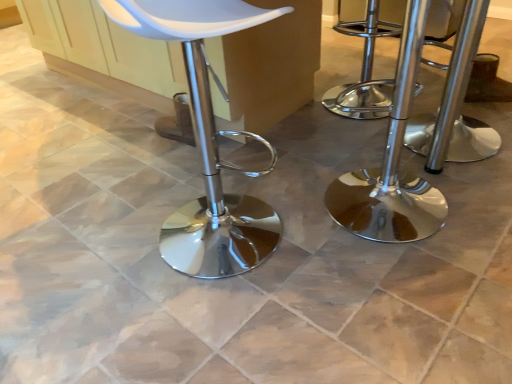
Question: Can you confirm if white matte stool at center is wider than chrome/metallic stool at right, acting as the first stool starting from the left?

Choices:
 (A) no
 (B) yes

Answer: (B)

Question: Does white matte stool at center come behind chrome/metallic stool at right, the second stool positioned from the right?

Choices:
 (A) yes
 (B) no

Answer: (B)

Question: Does white matte stool at center have a smaller size compared to chrome/metallic stool at right, acting as the first stool starting from the left?

Choices:
 (A) no
 (B) yes

Answer: (A)

Question: From the image's perspective, is white matte stool at center located beneath chrome/metallic stool at right, the second stool positioned from the right?

Choices:
 (A) no
 (B) yes

Answer: (B)

Question: Can you confirm if white matte stool at center is positioned to the left of chrome/metallic stool at right, the second stool positioned from the right?

Choices:
 (A) yes
 (B) no

Answer: (A)

Question: Is white matte stool at center aimed at chrome/metallic stool at right, the second stool positioned from the right?

Choices:
 (A) no
 (B) yes

Answer: (B)

Question: From the image's perspective, would you say polished chrome stool at center, which is the 2th stool from left to right, is positioned over chrome/metallic stool at right, the second stool positioned from the right?

Choices:
 (A) yes
 (B) no

Answer: (A)

Question: Can you confirm if polished chrome stool at center, which is the 2th stool from left to right, is positioned to the left of chrome/metallic stool at right, acting as the first stool starting from the left?

Choices:
 (A) no
 (B) yes

Answer: (A)

Question: Is polished chrome stool at center, the first stool when ordered from right to left, positioned with its back to chrome/metallic stool at right, acting as the first stool starting from the left?

Choices:
 (A) yes
 (B) no

Answer: (B)

Question: Is polished chrome stool at center, the first stool when ordered from right to left, far away from chrome/metallic stool at right, acting as the first stool starting from the left?

Choices:
 (A) yes
 (B) no

Answer: (B)

Question: Is polished chrome stool at center, which is the 2th stool from left to right, in front of chrome/metallic stool at right, the second stool positioned from the right?

Choices:
 (A) no
 (B) yes

Answer: (A)

Question: From the image's perspective, is polished chrome stool at center, the first stool when ordered from right to left, below chrome/metallic stool at right, the second stool positioned from the right?

Choices:
 (A) no
 (B) yes

Answer: (A)

Question: Does polished chrome stool at center, the first stool when ordered from right to left, appear on the right side of white matte stool at center?

Choices:
 (A) no
 (B) yes

Answer: (B)